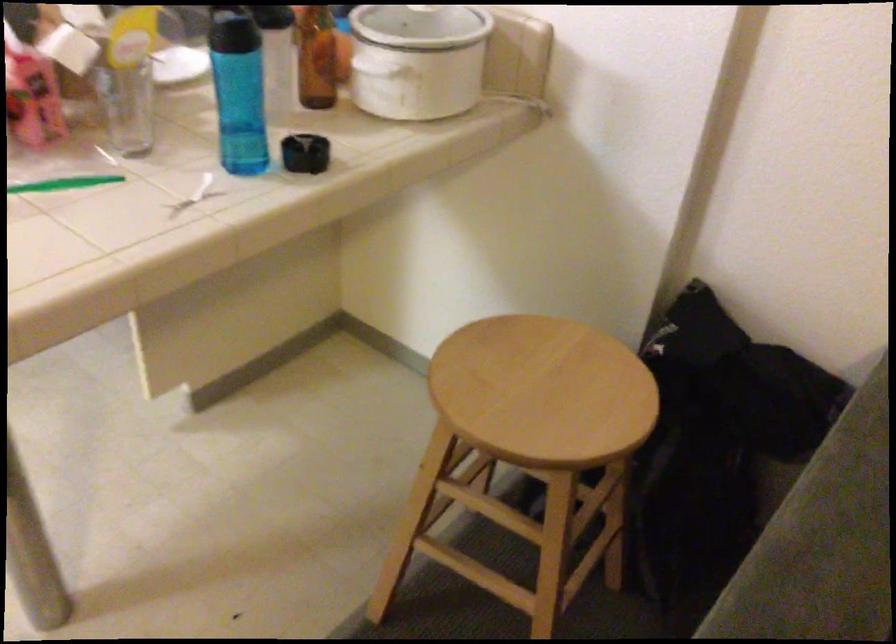
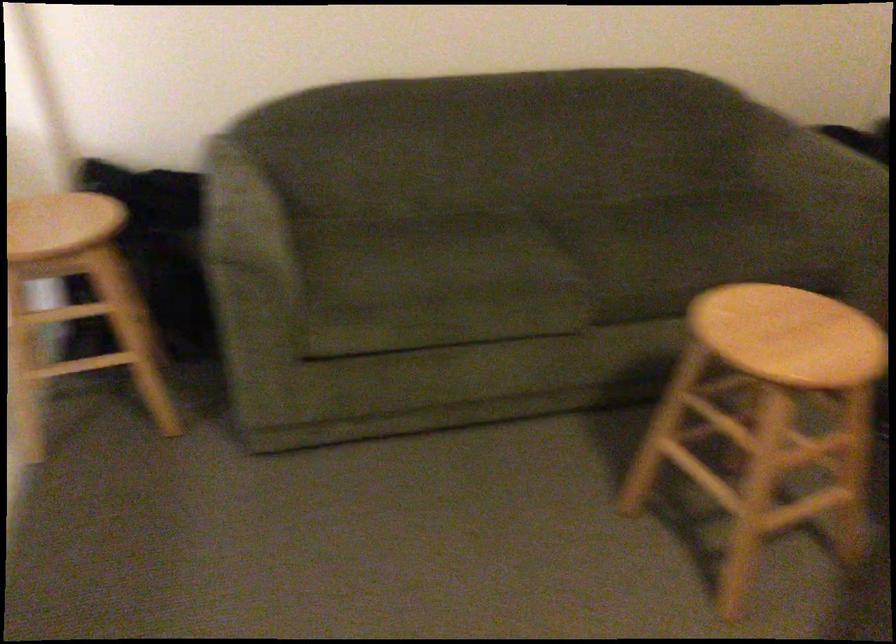
The point at (564, 389) is marked in the first image. Where is the corresponding point in the second image?

(59, 223)